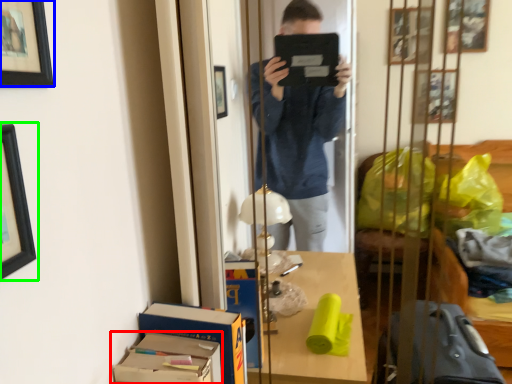
Question: Considering the real-world distances, which object is closest to cardboard box (highlighted by a red box)? picture frame (highlighted by a blue box) or picture frame (highlighted by a green box).

Choices:
 (A) picture frame
 (B) picture frame

Answer: (B)